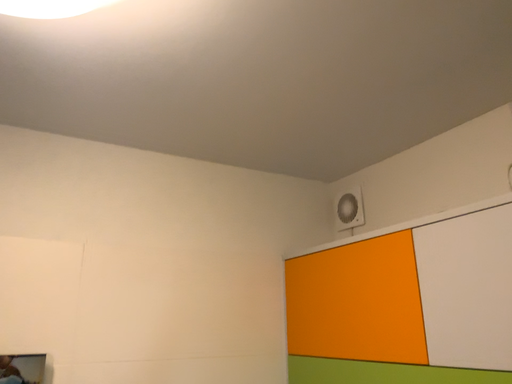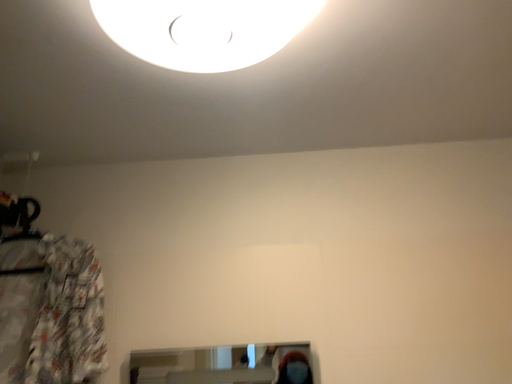
Question: Which way did the camera rotate in the video?

Choices:
 (A) rotated right
 (B) rotated left

Answer: (B)